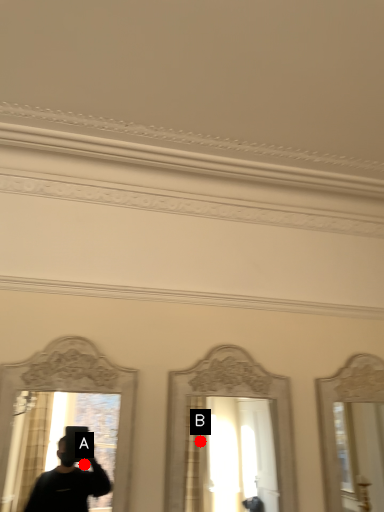
Question: Two points are circled on the image, labeled by A and B beside each circle. Which point appears closest to the camera in this image?

Choices:
 (A) A is closer
 (B) B is closer

Answer: (B)